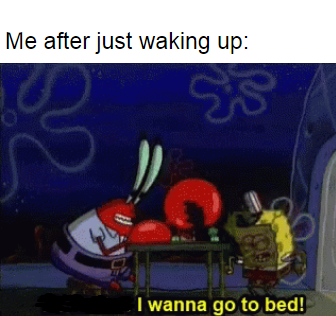
This screenshot has width=336, height=316. In order to click on table in this screenshot , I will do `click(197, 249)`.